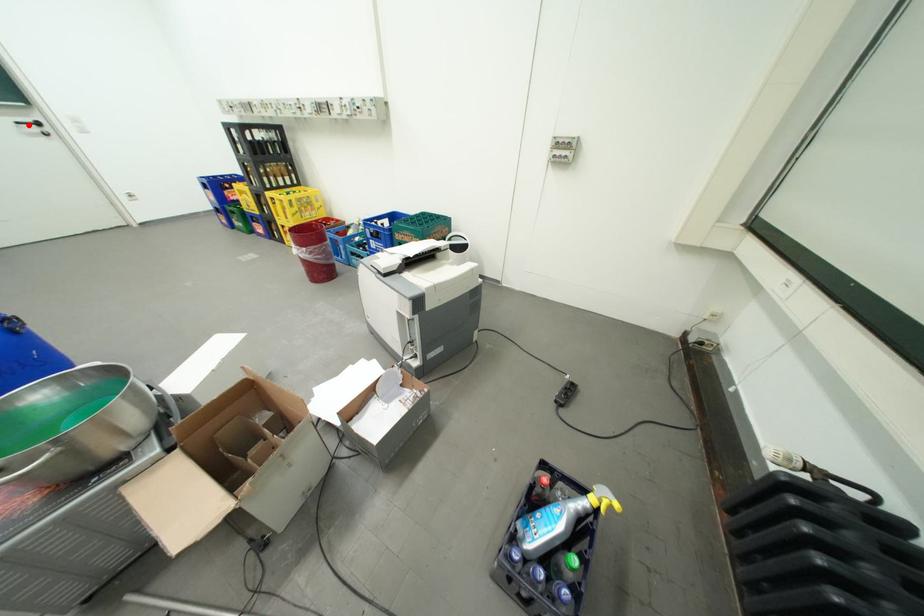
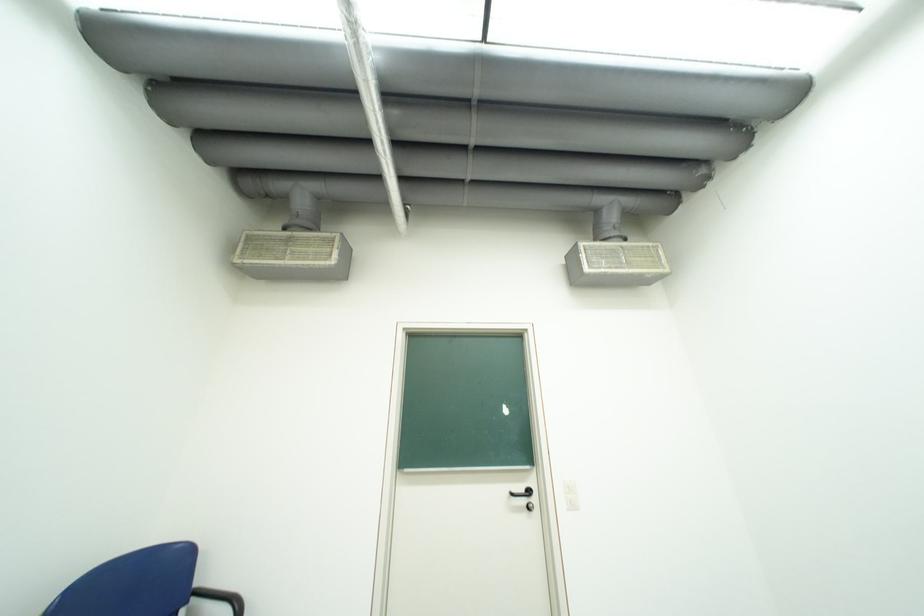
Locate, in the second image, the point that corresponds to the highlighted location in the first image.

(523, 495)